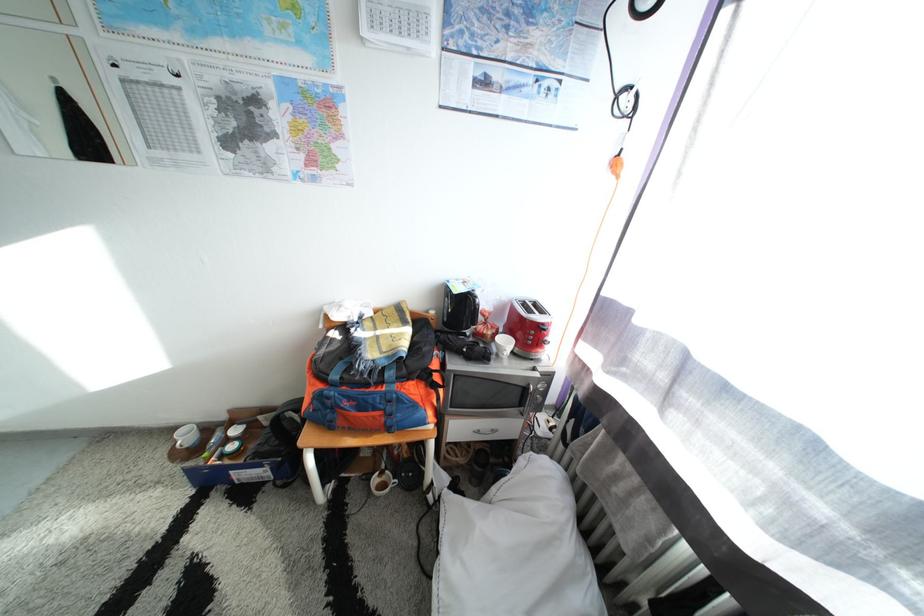
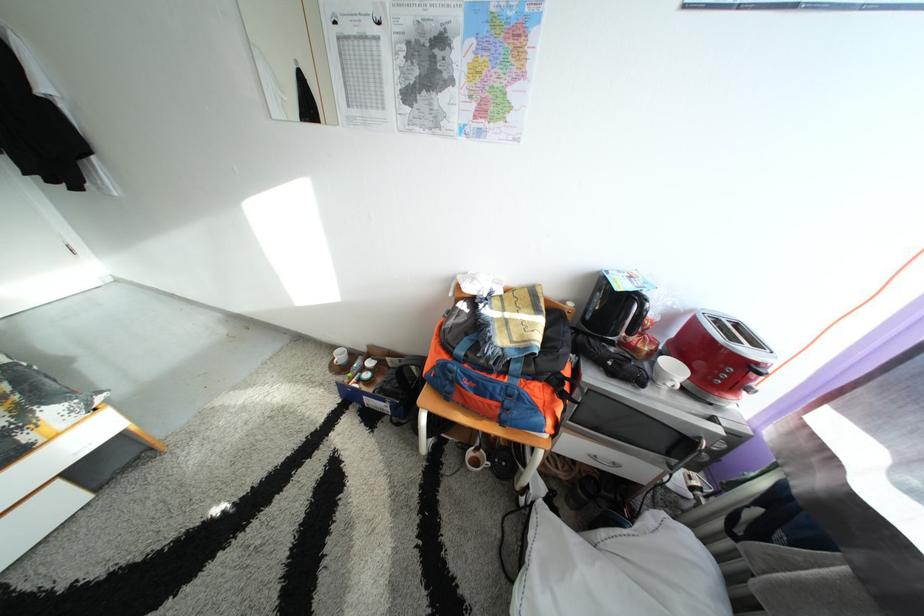
The point at (467, 294) is marked in the first image. Where is the corresponding point in the second image?

(630, 292)